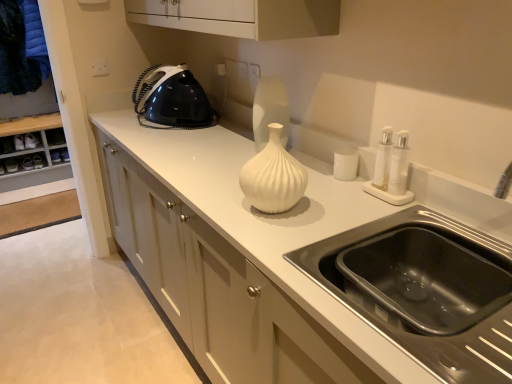
What do you see at coordinates (217, 289) in the screenshot? This screenshot has height=384, width=512. I see `white glossy cabinet at center` at bounding box center [217, 289].

The height and width of the screenshot is (384, 512). What do you see at coordinates (17, 53) in the screenshot?
I see `dark blue fabric at left` at bounding box center [17, 53].

What is the approximate height of wooden dresser at left?

It is 4.77 feet.

Locate an element on the screen. The height and width of the screenshot is (384, 512). white plastic electric outlet at center, the 2th electric outlet positioned from the left is located at coordinates (254, 72).

What do you see at coordinates (273, 176) in the screenshot?
I see `white matte vase at center` at bounding box center [273, 176].

Describe the element at coordinates (425, 289) in the screenshot. I see `black stainless steel sink at lower right` at that location.

You are a GUI agent. You are given a task and a screenshot of the screen. Output one action in this format:
    pyautogui.click(x=<x>, y=<y>)
    Task: Click on the white plastic electric outlet at upper center, acting as the 2th electric outlet starting from the bottom
    This screenshot has height=384, width=512.
    Given the screenshot: What is the action you would take?
    pyautogui.click(x=100, y=68)

From a real-world perspective, which object rests below the other?

wooden dresser at left, from a real-world perspective.

Is wooden dresser at left touching white plastic electric outlet at center, the first electric outlet in the front-to-back sequence?

No, wooden dresser at left is not in contact with white plastic electric outlet at center, the first electric outlet in the front-to-back sequence.

Based on the photo, is wooden dresser at left not within white plastic electric outlet at center, the first electric outlet in the front-to-back sequence?

That's correct, wooden dresser at left is outside of white plastic electric outlet at center, the first electric outlet in the front-to-back sequence.

Which object is closer to the camera, white matte cup at center or wooden dresser at left?

white matte cup at center is more forward.

Can you confirm if white matte cup at center is thinner than wooden dresser at left?

Correct, the width of white matte cup at center is less than that of wooden dresser at left.

Considering the positions of point (354, 157) and point (2, 101), is point (354, 157) closer or farther from the camera than point (2, 101)?

Point (354, 157) appears to be closer to the viewer than point (2, 101).

Between white matte cup at center and wooden dresser at left, which one has more height?

wooden dresser at left is taller.

Which of these two, white plastic electric outlet at upper center, the 1th electric outlet from the back, or white glossy cabinet at center, stands shorter?

With less height is white plastic electric outlet at upper center, the 1th electric outlet from the back.

Looking at their sizes, would you say white plastic electric outlet at upper center, placed as the 1th electric outlet when sorted from top to bottom, is wider or thinner than white glossy cabinet at center?

In the image, white plastic electric outlet at upper center, placed as the 1th electric outlet when sorted from top to bottom, appears to be more narrow than white glossy cabinet at center.

From the image's perspective, which object appears higher, white plastic electric outlet at upper center, acting as the 2th electric outlet starting from the bottom, or white glossy cabinet at center?

white plastic electric outlet at upper center, acting as the 2th electric outlet starting from the bottom, is shown above in the image.

Which is more to the left, white plastic electric outlet at upper center, placed as the 1th electric outlet when sorted from top to bottom, or white glossy cabinet at center?

Positioned to the left is white plastic electric outlet at upper center, placed as the 1th electric outlet when sorted from top to bottom.

Is point (61, 173) more distant than point (468, 239)?

Yes.

In the scene shown: Considering the relative sizes of wooden dresser at left and black stainless steel sink at lower right in the image provided, is wooden dresser at left smaller than black stainless steel sink at lower right?

Incorrect, wooden dresser at left is not smaller in size than black stainless steel sink at lower right.

From the image's perspective, is wooden dresser at left above or below black stainless steel sink at lower right?

Based on their image positions, wooden dresser at left is located above black stainless steel sink at lower right.

Would you say wooden dresser at left is inside or outside black stainless steel sink at lower right?

wooden dresser at left is located beyond the bounds of black stainless steel sink at lower right.

Would you say dark blue fabric at left is inside or outside white matte vase at center?

dark blue fabric at left lies outside white matte vase at center.

Is point (36, 71) farther from camera compared to point (279, 138)?

Yes, point (36, 71) is farther from viewer.

Considering the sizes of objects dark blue fabric at left and white matte vase at center in the image provided, who is shorter, dark blue fabric at left or white matte vase at center?

Standing shorter between the two is white matte vase at center.

From a real-world perspective, is white glossy cabinet at center under white matte vase at center?

Correct, in the physical world, white glossy cabinet at center is lower than white matte vase at center.

Considering the positions of objects white glossy cabinet at center and white matte vase at center in the image provided, who is behind, white glossy cabinet at center or white matte vase at center?

white matte vase at center is behind.

Considering the sizes of objects white glossy cabinet at center and white matte vase at center in the image provided, who is shorter, white glossy cabinet at center or white matte vase at center?

Standing shorter between the two is white matte vase at center.

In the scene shown: Would you say white glossy cabinet at center is outside white matte vase at center?

Yes, white glossy cabinet at center is located beyond the bounds of white matte vase at center.

Which object is thinner, white glossy cabinet at center or black plastic iron at upper left?

With smaller width is black plastic iron at upper left.

From a real-world perspective, is white glossy cabinet at center on black plastic iron at upper left?

No, from a real-world perspective, white glossy cabinet at center is not on top of black plastic iron at upper left.

Can you tell me how much white glossy cabinet at center and black plastic iron at upper left differ in facing direction?

0.000129 degrees separate the facing orientations of white glossy cabinet at center and black plastic iron at upper left.

Could black plastic iron at upper left be considered to be inside white glossy cabinet at center?

No, black plastic iron at upper left is not surrounded by white glossy cabinet at center.

From a real-world perspective, starting from the wooden dresser at left, which electric outlet is the 2nd one vertically above it? Please provide its 2D coordinates.

[(254, 72)]

At what (x,y) coordinates should I click in order to perform the action: click on kitchen appliance in front of the wooden dresser at left. Please return your answer as a coordinate pair (x, y). This screenshot has width=512, height=384. Looking at the image, I should click on (345, 164).

Which object lies further to the anchor point dark blue fabric at left, white plastic electric outlet at center, which is counted as the first electric outlet, starting from the bottom, or black plastic iron at upper left?

white plastic electric outlet at center, which is counted as the first electric outlet, starting from the bottom, is further to dark blue fabric at left.

Which object lies nearer to the anchor point black plastic iron at upper left, white matte vase at center or white matte cup at center?

The object closer to black plastic iron at upper left is white matte cup at center.

Considering their positions, is black plastic iron at upper left positioned further to white matte vase at center than white plastic electric outlet at center, which is counted as the first electric outlet, starting from the bottom?

black plastic iron at upper left lies further to white matte vase at center than the other object.

From the image, which object appears to be farther from white plastic electric outlet at upper center, acting as the 2th electric outlet starting from the bottom, wooden dresser at left or white glossy cabinet at center?

Among the two, wooden dresser at left is located further to white plastic electric outlet at upper center, acting as the 2th electric outlet starting from the bottom.

Considering their positions, is white matte vase at center positioned further to dark blue fabric at left than black stainless steel sink at lower right?

Based on the image, black stainless steel sink at lower right appears to be further to dark blue fabric at left.

When comparing their distances from white matte cup at center, does dark blue fabric at left or white glossy cabinet at center seem further?

The object further to white matte cup at center is dark blue fabric at left.

Based on their spatial positions, is black plastic iron at upper left or wooden dresser at left closer to dark blue fabric at left?

wooden dresser at left.

Considering their positions, is black stainless steel sink at lower right positioned further to wooden dresser at left than white glossy cabinet at center?

black stainless steel sink at lower right is further to wooden dresser at left.

Identify the location of electric outlet between dark blue fabric at left and white plastic electric outlet at center, which is counted as the first electric outlet, starting from the bottom, in the horizontal direction. Image resolution: width=512 pixels, height=384 pixels. (100, 68).

This screenshot has height=384, width=512. In order to click on home appliance located between white glossy cabinet at center and dark blue fabric at left in the depth direction in this screenshot , I will do click(173, 99).

The width and height of the screenshot is (512, 384). Find the location of `vase between white glossy cabinet at center and black plastic iron at upper left along the z-axis`. vase between white glossy cabinet at center and black plastic iron at upper left along the z-axis is located at coordinates (273, 176).

This screenshot has height=384, width=512. I want to click on kitchen appliance between dark blue fabric at left and black stainless steel sink at lower right from left to right, so click(x=345, y=164).